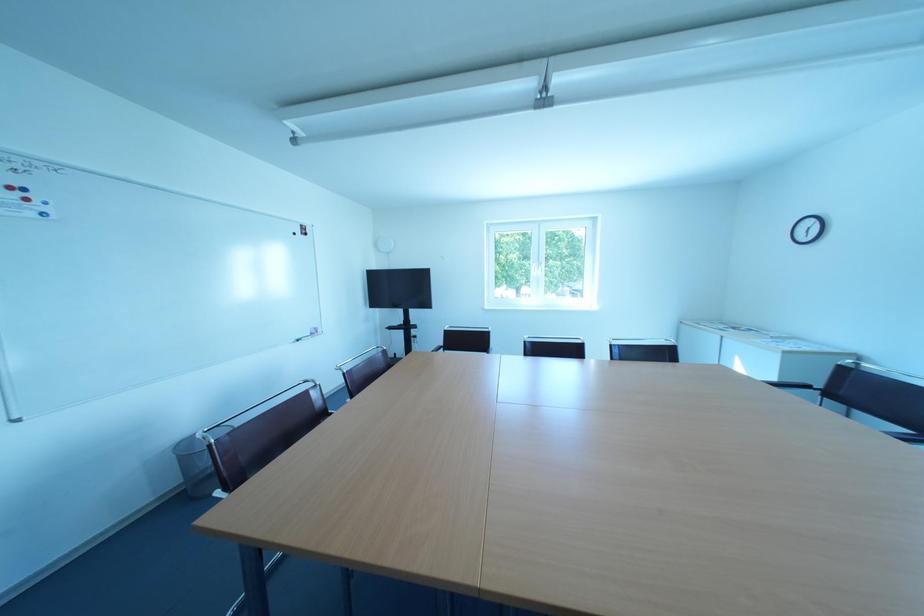
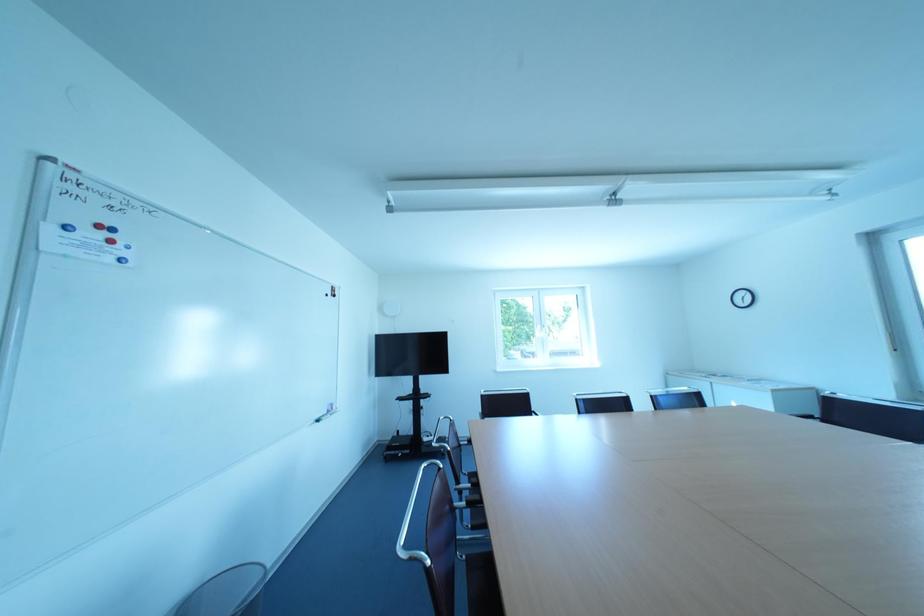
Question: The images are taken continuously from a first-person perspective. In which direction is your viewpoint rotating?

Choices:
 (A) Left
 (B) Right
 (C) Up
 (D) Down

Answer: (C)